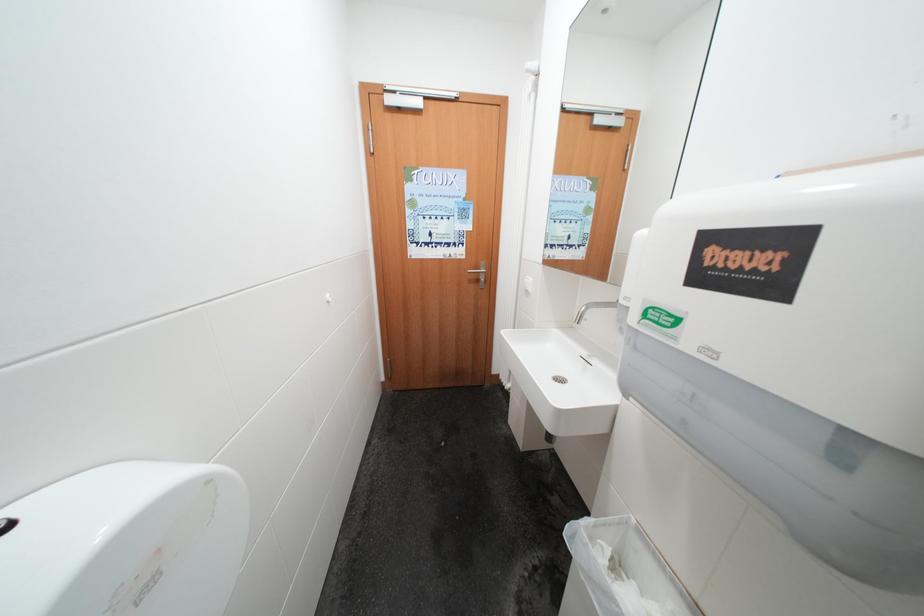
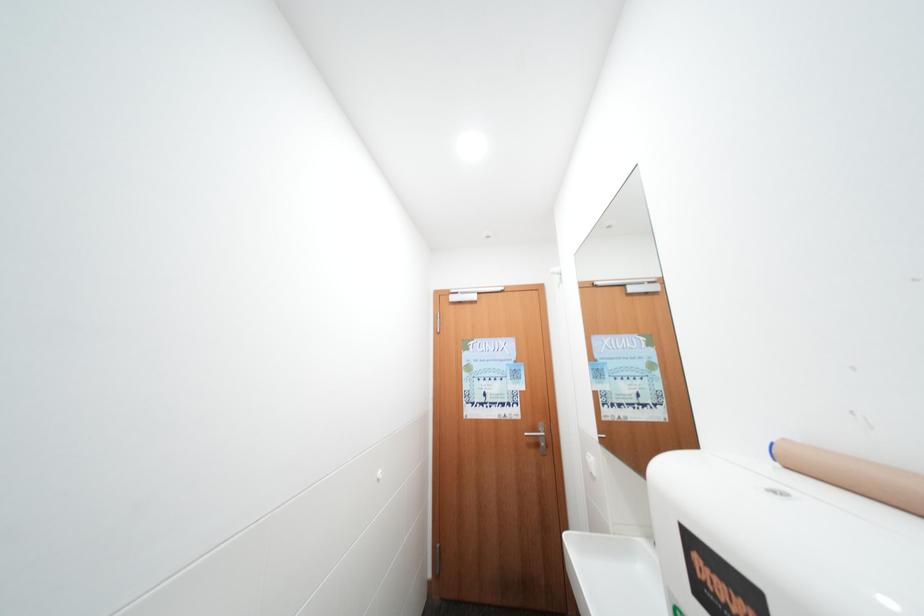
First-person continuous shooting, in which direction is the camera rotating?

The rotation direction of the camera is left-up.